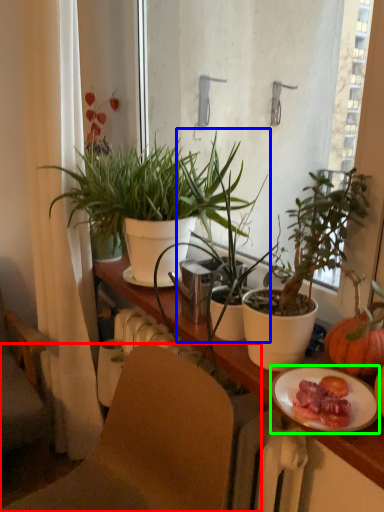
Question: Estimate the real-world distances between objects in this image. Which object is closer to chair (highlighted by a red box), houseplant (highlighted by a blue box) or plate (highlighted by a green box)?

Choices:
 (A) houseplant
 (B) plate

Answer: (B)